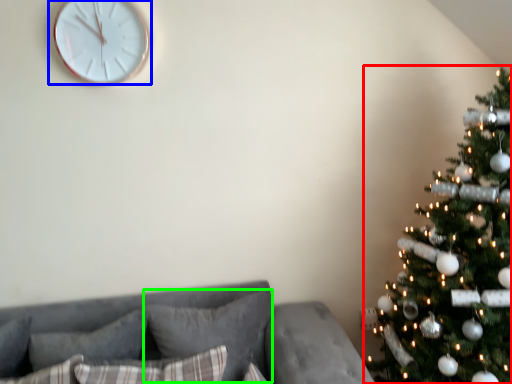
Question: Estimate the real-world distances between objects in this image. Which object is closer to christmas tree (highlighted by a red box), wall clock (highlighted by a blue box) or pillow (highlighted by a green box)?

Choices:
 (A) wall clock
 (B) pillow

Answer: (B)